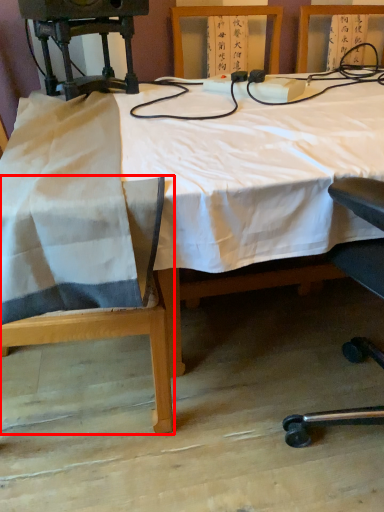
Question: In this image, where is chair (annotated by the red box) located relative to table?

Choices:
 (A) left
 (B) right

Answer: (A)